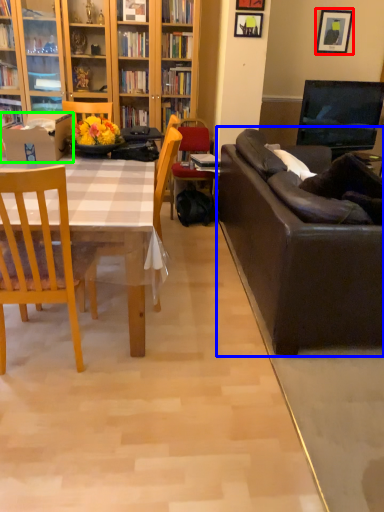
Question: Considering the real-world distances, which object is closest to picture frame (highlighted by a red box)? studio couch (highlighted by a blue box) or box (highlighted by a green box).

Choices:
 (A) studio couch
 (B) box

Answer: (A)